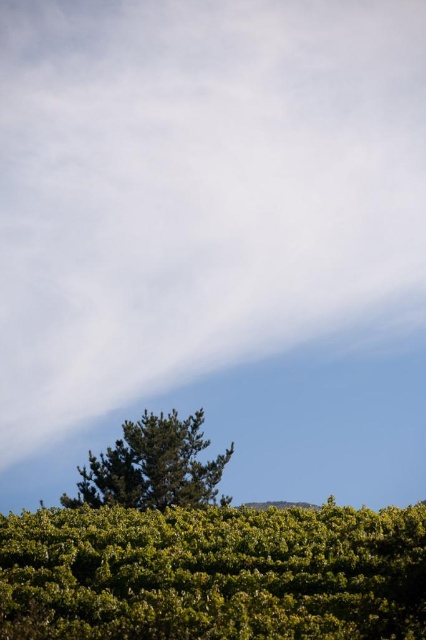
Question: Which point appears closest to the camera in this image?

Choices:
 (A) (126, 564)
 (B) (88, 474)

Answer: (A)

Question: Which point is farther to the camera?

Choices:
 (A) green textured tree at lower center
 (B) green leafy bush at lower center

Answer: (A)

Question: Which point is closer to the camera taking this photo?

Choices:
 (A) (423, 595)
 (B) (210, 468)

Answer: (A)

Question: Does green leafy bush at lower center have a larger size compared to green textured tree at lower center?

Choices:
 (A) yes
 (B) no

Answer: (B)

Question: Can you confirm if green leafy bush at lower center is positioned to the right of green textured tree at lower center?

Choices:
 (A) no
 (B) yes

Answer: (B)

Question: Is the position of green leafy bush at lower center more distant than that of green textured tree at lower center?

Choices:
 (A) yes
 (B) no

Answer: (B)